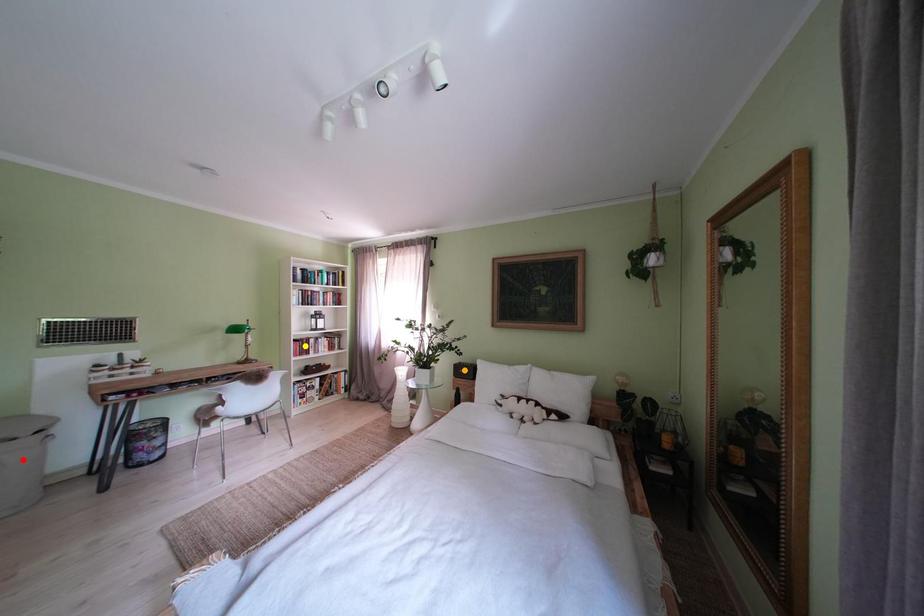
Order these from farthest to nearest:
- red point
- orange point
- yellow point

1. yellow point
2. orange point
3. red point